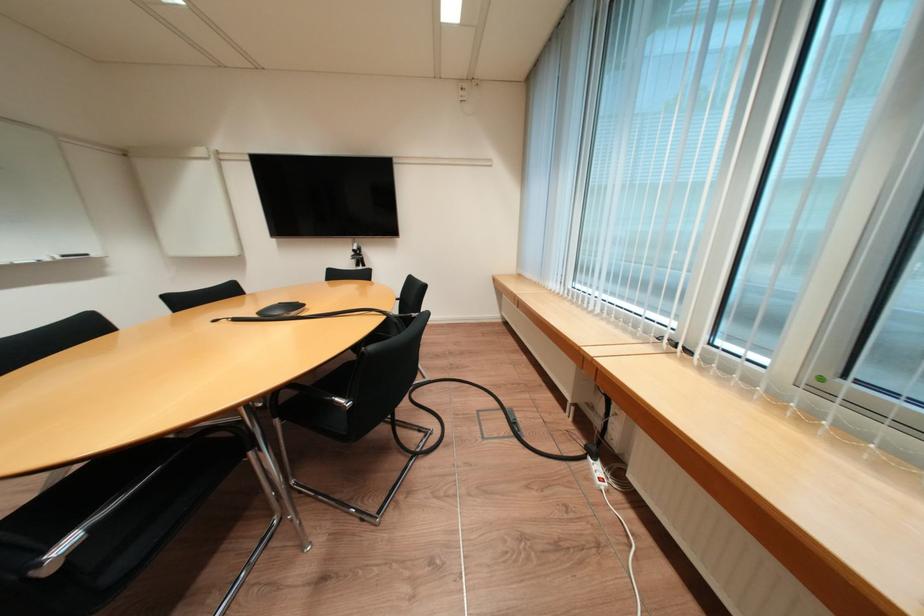
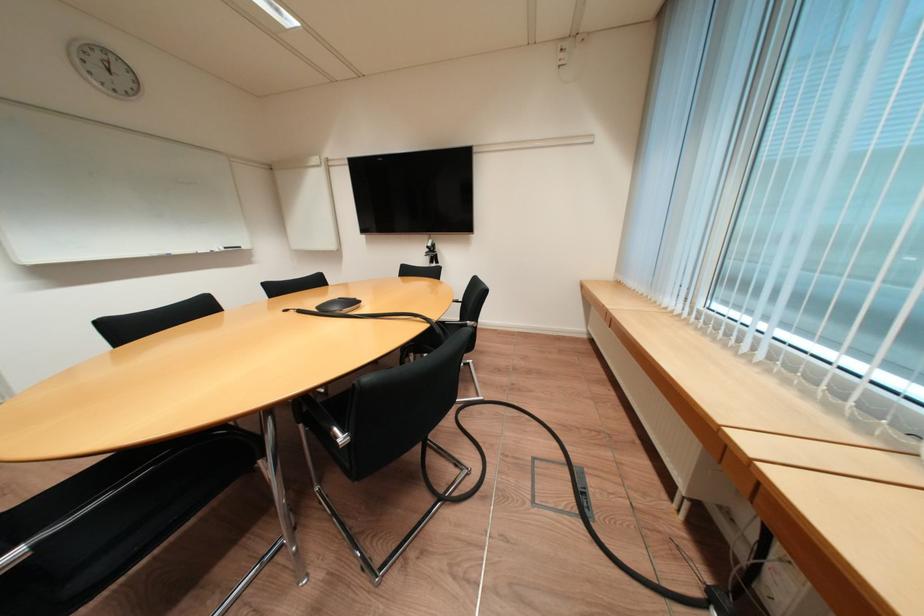
Question: Based on the continuous images, in which direction is the camera rotating? Reply with the corresponding letter.

Choices:
 (A) Left
 (B) Right
 (C) Up
 (D) Down

Answer: (A)